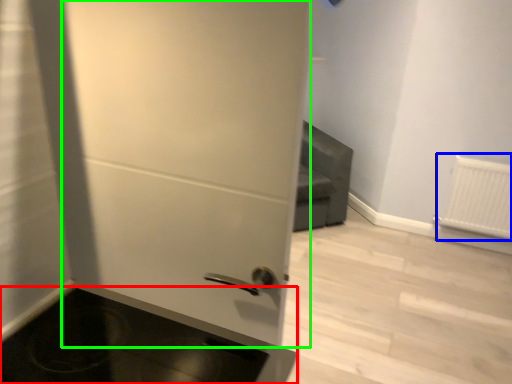
Question: Which object is positioned farthest from appliance (highlighted by a red box)? Select from radiator (highlighted by a blue box) and door (highlighted by a green box).

Choices:
 (A) radiator
 (B) door

Answer: (A)